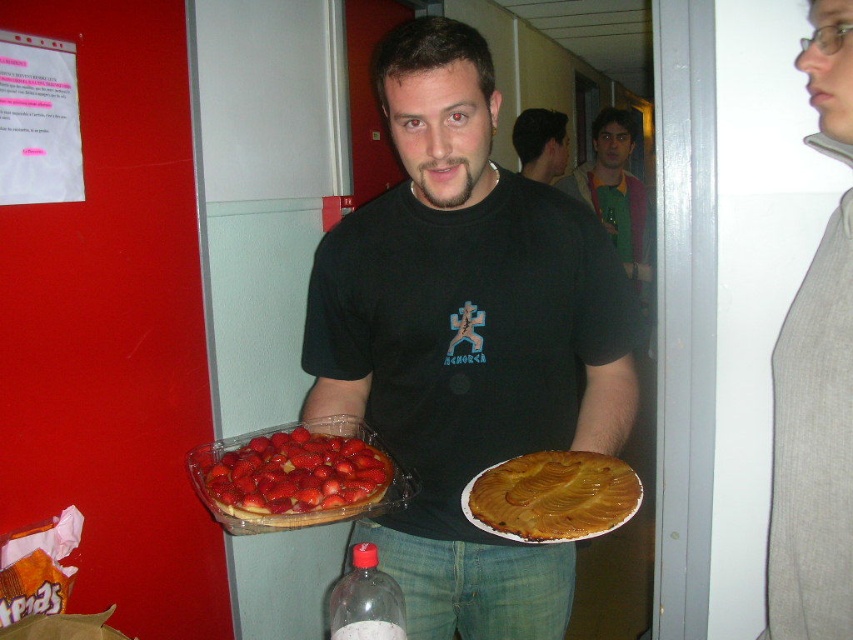
Question: Based on their relative distances, which object is nearer to the golden caramelized pie at center?

Choices:
 (A) gray ribbed sweater at center
 (B) glossy plastic strawberry at center
 (C) translucent plastic bottle at lower center

Answer: (B)

Question: Does black matte t-shirt at center have a smaller size compared to smooth black shirt at center?

Choices:
 (A) no
 (B) yes

Answer: (A)

Question: Can you confirm if golden caramelized pie at center is wider than translucent plastic bottle at lower center?

Choices:
 (A) yes
 (B) no

Answer: (A)

Question: Does black matte t-shirt at center appear on the left side of translucent plastic bottle at lower center?

Choices:
 (A) yes
 (B) no

Answer: (B)

Question: Which object is positioned closest to the golden caramelized pie at center?

Choices:
 (A) gray ribbed sweater at center
 (B) black matte t-shirt at center

Answer: (B)

Question: Which point is farther to the camera?

Choices:
 (A) (291, 464)
 (B) (602, 170)
 (C) (368, 557)

Answer: (B)